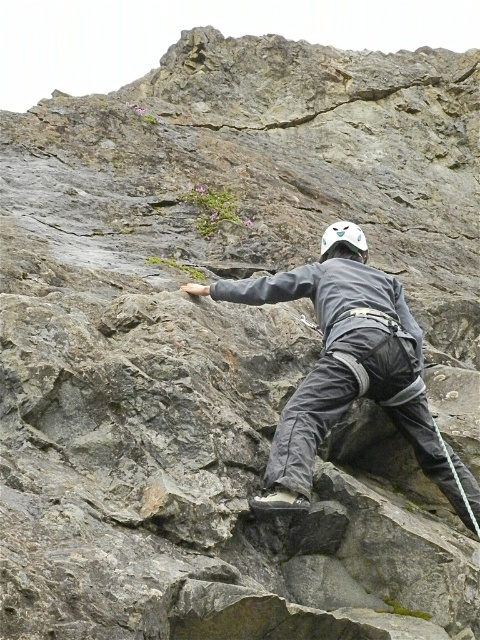
Question: Is gray fabric helmet at center thinner than white matte helmet at center?

Choices:
 (A) no
 (B) yes

Answer: (A)

Question: Is gray fabric helmet at center below white matte helmet at center?

Choices:
 (A) yes
 (B) no

Answer: (A)

Question: Is the position of gray fabric helmet at center less distant than that of white matte helmet at center?

Choices:
 (A) no
 (B) yes

Answer: (B)

Question: Which object appears farthest from the camera in this image?

Choices:
 (A) white matte helmet at center
 (B) gray fabric helmet at center

Answer: (A)

Question: Which point is closer to the camera taking this photo?

Choices:
 (A) (348, 244)
 (B) (336, 289)

Answer: (B)

Question: Which of the following is the farthest from the observer?

Choices:
 (A) (368, 372)
 (B) (342, 236)

Answer: (B)